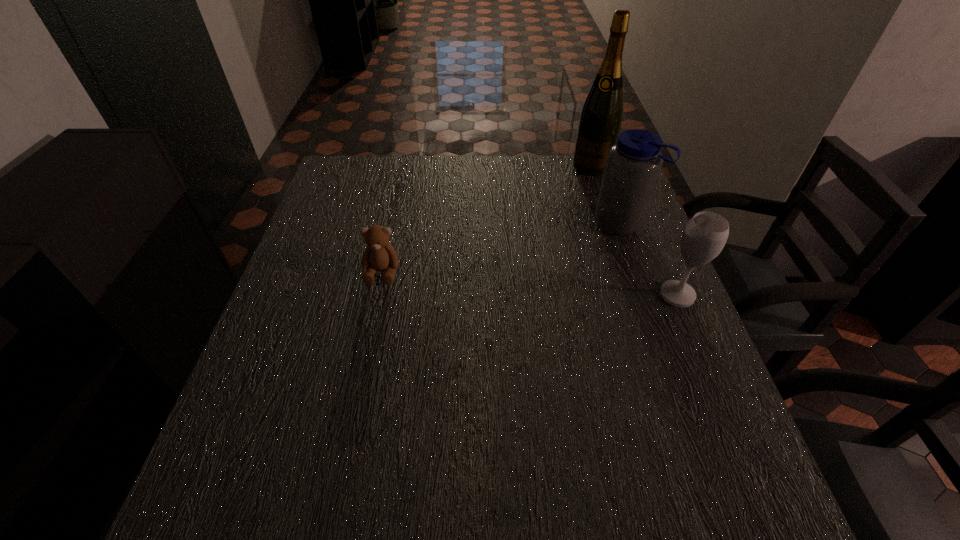
The image size is (960, 540). In order to click on vacant spot on the desktop that is between the shortest object and the wineglass and is positioned on the front-facing side of the tallest object in this screenshot , I will do `click(535, 284)`.

Where is `vacant spot on the desktop that is between the shortest object and the wineglass and is positioned with a carrying loop on the side of the third nearest object`? This screenshot has width=960, height=540. vacant spot on the desktop that is between the shortest object and the wineglass and is positioned with a carrying loop on the side of the third nearest object is located at coordinates (553, 285).